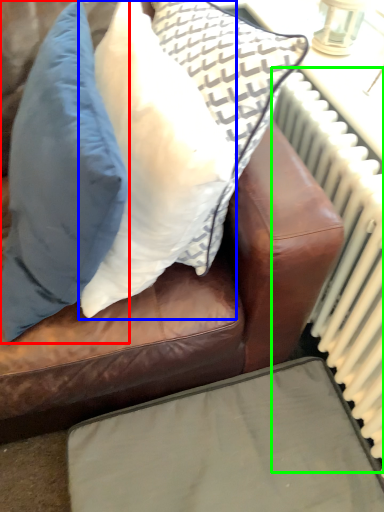
Question: Which object is the closest to the pillow (highlighted by a red box)? Choose among these: pillow (highlighted by a blue box) or radiator (highlighted by a green box).

Choices:
 (A) pillow
 (B) radiator

Answer: (A)